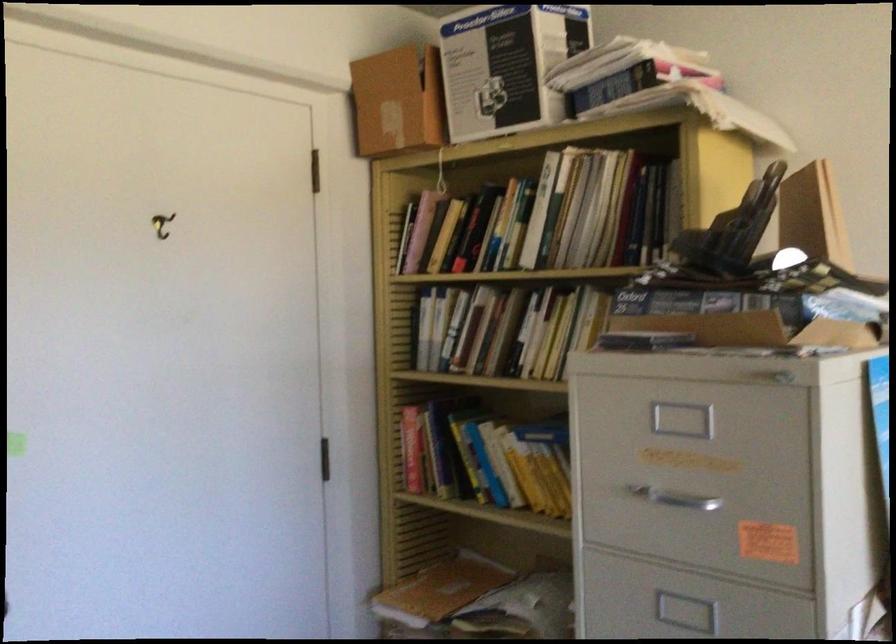
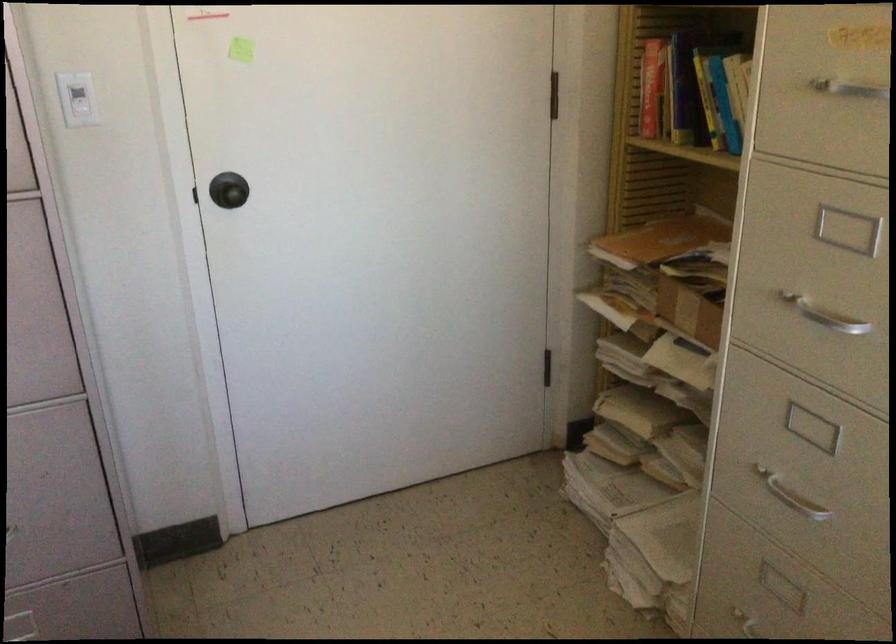
Locate, in the second image, the point that corresponds to (651,485) in the first image.

(839, 82)